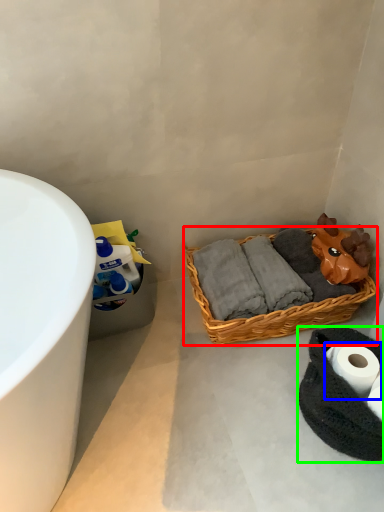
Question: Which is nearer to the picnic basket (highlighted by a red box)? toilet paper (highlighted by a blue box) or material (highlighted by a green box).

Choices:
 (A) toilet paper
 (B) material

Answer: (B)